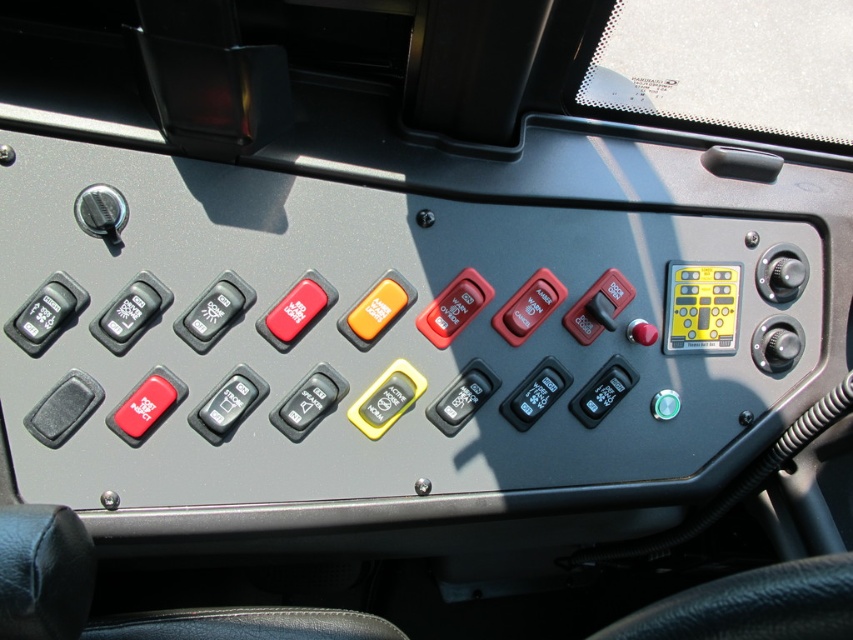
You are a technician trying to identify components on the control panel. The yellow matte keypad at upper right and the satin black knob at right are both in your line of sight. Which component is taller?

The yellow matte keypad at upper right has a greater height compared to the satin black knob at right, so the yellow matte keypad at upper right is taller.

You are a driver who needs to locate the yellow matte keypad at upper right and the metallic knob at upper left on the control panel. Based on their positions, which object is on the right side of the panel?

The yellow matte keypad at upper right is on the right side of the panel because it is positioned to the right of the metallic knob at upper left.